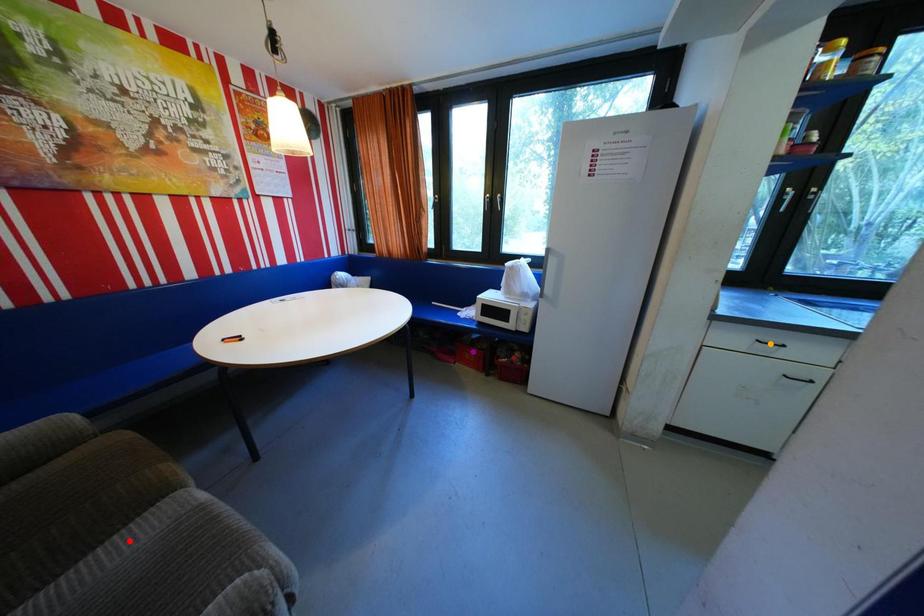
Order these from nearest to farthest:
- orange point
- purple point
- red point

red point → orange point → purple point